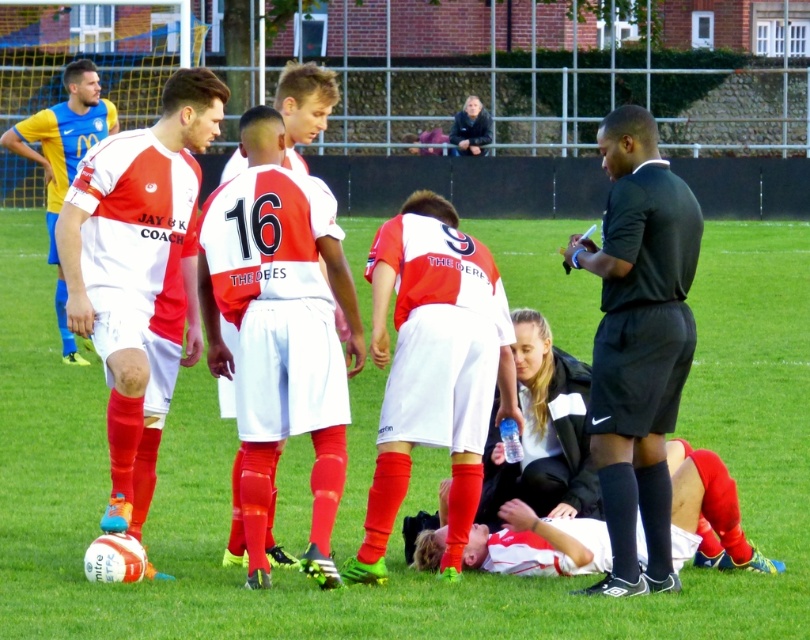
Question: Which point is closer to the camera?

Choices:
 (A) (600, 433)
 (B) (60, 442)

Answer: (A)

Question: Does green grass at center appear over black smooth shirt at right?

Choices:
 (A) no
 (B) yes

Answer: (B)

Question: Is green grass at center below black smooth shirt at right?

Choices:
 (A) no
 (B) yes

Answer: (A)

Question: Can you confirm if green grass at center is positioned above black smooth shirt at right?

Choices:
 (A) yes
 (B) no

Answer: (A)